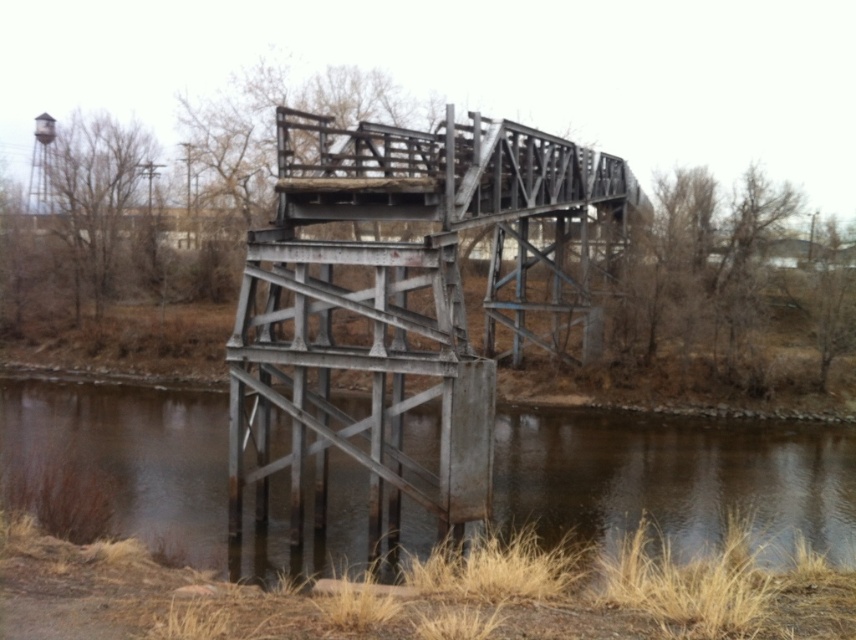
Does rusty metal bridge at center have a greater height compared to brown/rough concrete river at lower center?

Yes, rusty metal bridge at center is taller than brown/rough concrete river at lower center.

Between point (400, 403) and point (553, 522), which one is positioned in front?

Point (400, 403)

I want to click on rusty metal bridge at center, so click(406, 300).

This screenshot has height=640, width=856. In order to click on rusty metal bridge at center in this screenshot , I will do `click(406, 300)`.